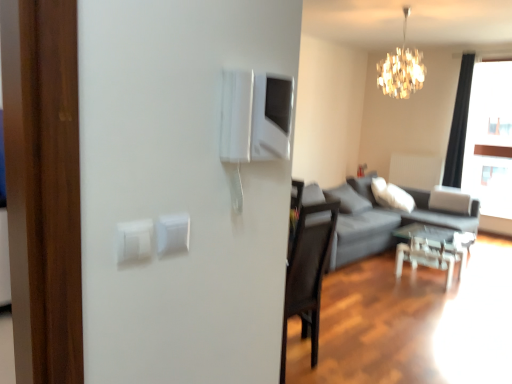
Question: From a real-world perspective, is shiny crystal chandelier at upper center on top of white plastic light switch at center, positioned as the 2th light switch in left-to-right order?

Choices:
 (A) yes
 (B) no

Answer: (A)

Question: Does shiny crystal chandelier at upper center lie in front of white plastic light switch at center, acting as the first light switch starting from the right?

Choices:
 (A) yes
 (B) no

Answer: (B)

Question: Is shiny crystal chandelier at upper center beside white plastic light switch at center, marked as the 2th light switch in a front-to-back arrangement?

Choices:
 (A) no
 (B) yes

Answer: (A)

Question: Is shiny crystal chandelier at upper center turned away from white plastic light switch at center, which appears as the first light switch when viewed from the back?

Choices:
 (A) yes
 (B) no

Answer: (B)

Question: Is shiny crystal chandelier at upper center positioned far away from white plastic light switch at center, acting as the first light switch starting from the right?

Choices:
 (A) no
 (B) yes

Answer: (B)

Question: Is shiny crystal chandelier at upper center taller than white plastic light switch at center, acting as the first light switch starting from the right?

Choices:
 (A) yes
 (B) no

Answer: (A)

Question: Can you confirm if white plastic light switch at center, which appears as the first light switch when viewed from the back, is thinner than shiny crystal chandelier at upper center?

Choices:
 (A) no
 (B) yes

Answer: (B)

Question: Considering the relative sizes of white plastic light switch at center, marked as the 2th light switch in a front-to-back arrangement, and shiny crystal chandelier at upper center in the image provided, is white plastic light switch at center, marked as the 2th light switch in a front-to-back arrangement, smaller than shiny crystal chandelier at upper center?

Choices:
 (A) no
 (B) yes

Answer: (B)

Question: Does white plastic light switch at center, positioned as the 2th light switch in left-to-right order, turn towards shiny crystal chandelier at upper center?

Choices:
 (A) yes
 (B) no

Answer: (B)

Question: Does white plastic light switch at center, positioned as the 2th light switch in left-to-right order, have a greater height compared to shiny crystal chandelier at upper center?

Choices:
 (A) no
 (B) yes

Answer: (A)

Question: Is white plastic light switch at center, which appears as the first light switch when viewed from the back, at the right side of shiny crystal chandelier at upper center?

Choices:
 (A) no
 (B) yes

Answer: (A)

Question: Does white plastic light switch at center, positioned as the 2th light switch in left-to-right order, come behind shiny crystal chandelier at upper center?

Choices:
 (A) yes
 (B) no

Answer: (B)

Question: Does dark gray fabric couch at right have a larger size compared to white plastic light switch at center, which appears as the first light switch when viewed from the back?

Choices:
 (A) yes
 (B) no

Answer: (A)